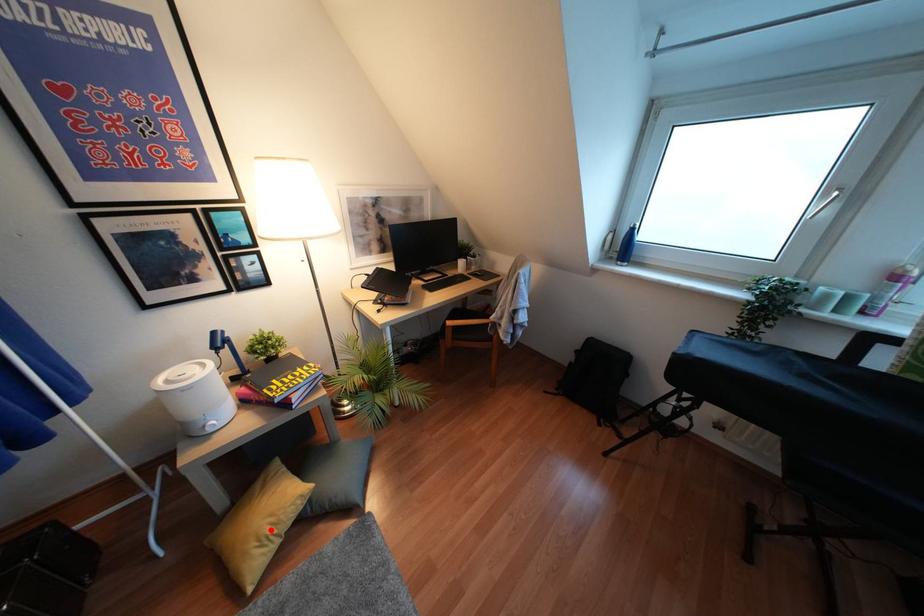
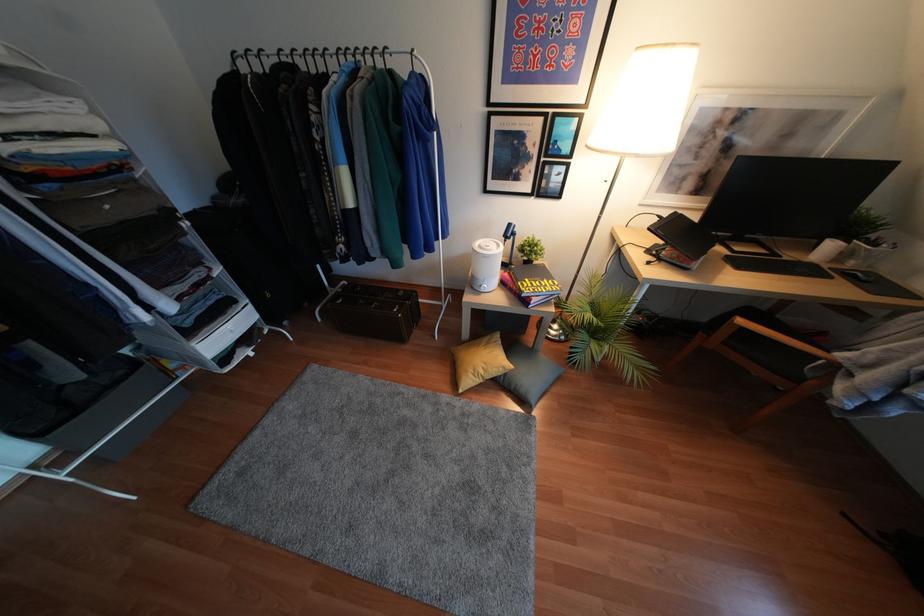
In the second image, find the point that corresponds to the highlighted location in the first image.

(480, 371)